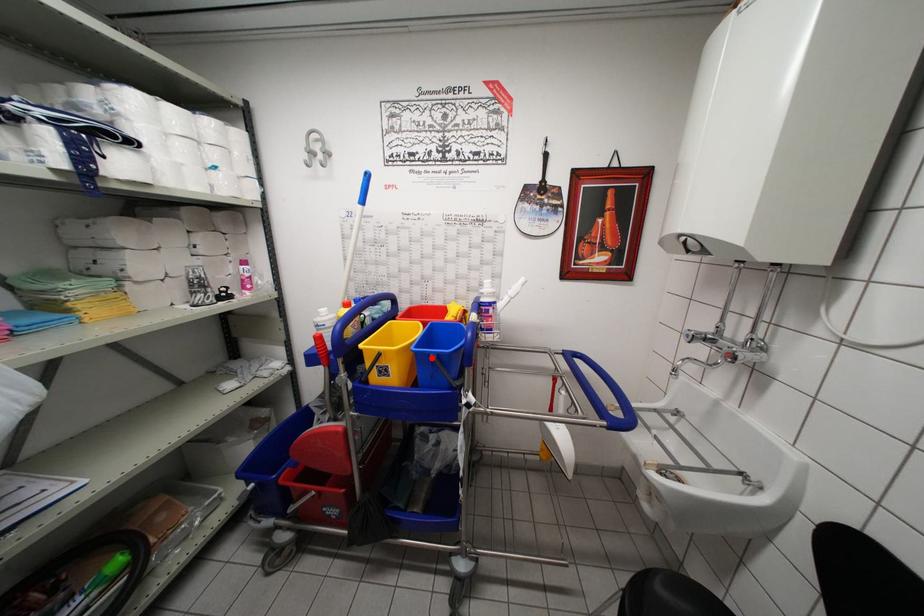
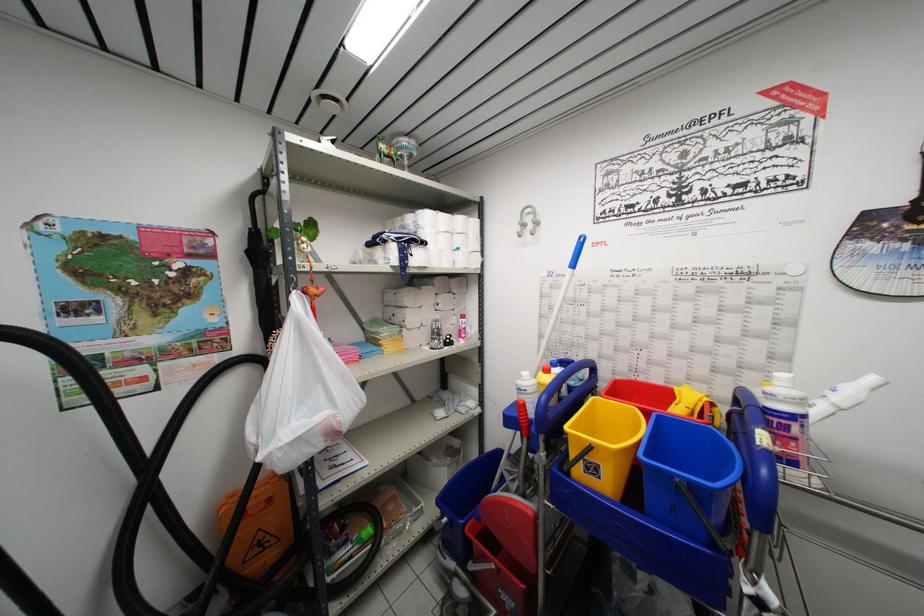
The point at the highlighted location is marked in the first image. Where is the corresponding point in the second image?

(675, 479)